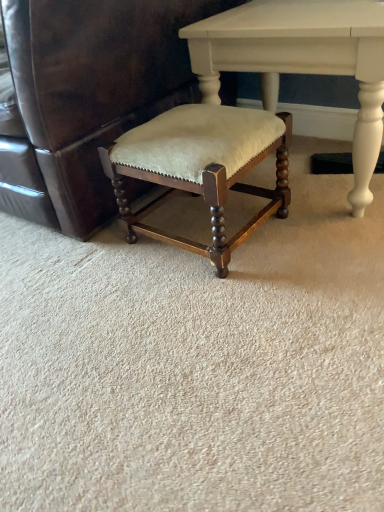
Question: From a real-world perspective, is velvet beige stool at center positioned over velvet beige cushioned stool at center based on gravity?

Choices:
 (A) yes
 (B) no

Answer: (B)

Question: Is velvet beige stool at center completely or partially outside of velvet beige cushioned stool at center?

Choices:
 (A) yes
 (B) no

Answer: (A)

Question: Can you confirm if velvet beige stool at center is taller than velvet beige cushioned stool at center?

Choices:
 (A) yes
 (B) no

Answer: (B)

Question: Is velvet beige stool at center turned away from velvet beige cushioned stool at center?

Choices:
 (A) yes
 (B) no

Answer: (B)

Question: Is velvet beige stool at center positioned in front of velvet beige cushioned stool at center?

Choices:
 (A) yes
 (B) no

Answer: (B)

Question: From the image's perspective, is matte white table at center above or below velvet beige stool at center?

Choices:
 (A) above
 (B) below

Answer: (A)

Question: Considering the positions of point (200, 83) and point (253, 125), is point (200, 83) closer or farther from the camera than point (253, 125)?

Choices:
 (A) closer
 (B) farther

Answer: (B)

Question: Considering the relative positions of matte white table at center and velvet beige stool at center in the image provided, is matte white table at center to the left or to the right of velvet beige stool at center?

Choices:
 (A) left
 (B) right

Answer: (B)

Question: Considering the positions of matte white table at center and velvet beige stool at center in the image, is matte white table at center taller or shorter than velvet beige stool at center?

Choices:
 (A) short
 (B) tall

Answer: (B)

Question: Is point (44, 202) closer or farther from the camera than point (130, 240)?

Choices:
 (A) farther
 (B) closer

Answer: (A)

Question: Is velvet beige cushioned stool at center wider or thinner than velvet beige stool at center?

Choices:
 (A) wide
 (B) thin

Answer: (A)

Question: Is velvet beige cushioned stool at center situated inside velvet beige stool at center or outside?

Choices:
 (A) outside
 (B) inside

Answer: (A)

Question: From a real-world perspective, is velvet beige cushioned stool at center positioned above or below velvet beige stool at center?

Choices:
 (A) below
 (B) above

Answer: (B)

Question: Relative to velvet beige cushioned stool at center, is matte white table at center in front or behind?

Choices:
 (A) behind
 (B) front

Answer: (A)

Question: From a real-world perspective, relative to velvet beige cushioned stool at center, is matte white table at center vertically above or below?

Choices:
 (A) above
 (B) below

Answer: (B)